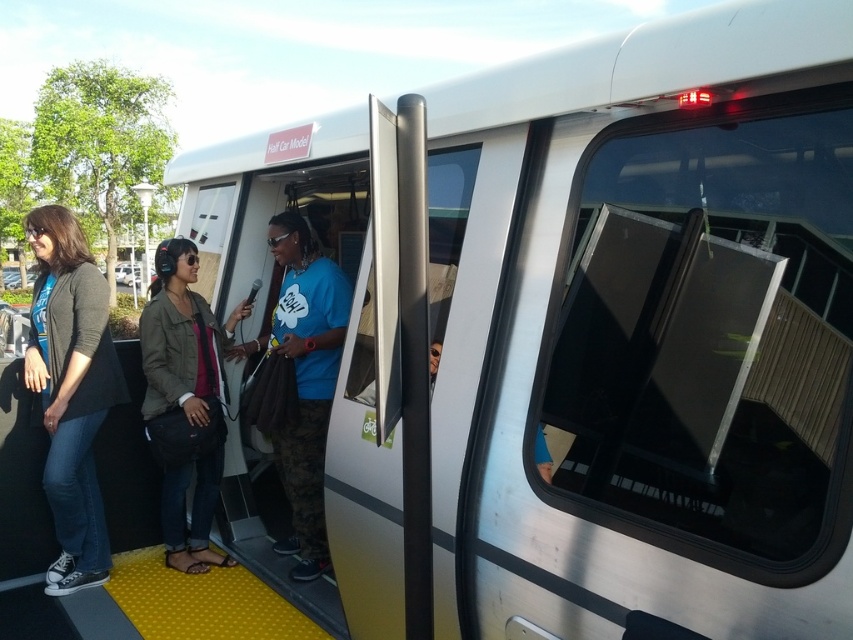
Question: Does denim jacket at center lie behind blue t-shirt at center?

Choices:
 (A) yes
 (B) no

Answer: (B)

Question: In this image, where is denim jacket at center located relative to blue t-shirt at center?

Choices:
 (A) above
 (B) below

Answer: (B)

Question: Does matte black jacket at left appear under blue t-shirt at center?

Choices:
 (A) no
 (B) yes

Answer: (A)

Question: Which point is closer to the camera taking this photo?

Choices:
 (A) (146, 305)
 (B) (280, 314)
 (C) (80, 300)

Answer: (C)

Question: Among these objects, which one is nearest to the camera?

Choices:
 (A) blue t-shirt at center
 (B) matte black jacket at left
 (C) denim jacket at center

Answer: (B)

Question: Among these points, which one is farthest from the camera?

Choices:
 (A) (78, 536)
 (B) (218, 394)
 (C) (297, 536)

Answer: (C)